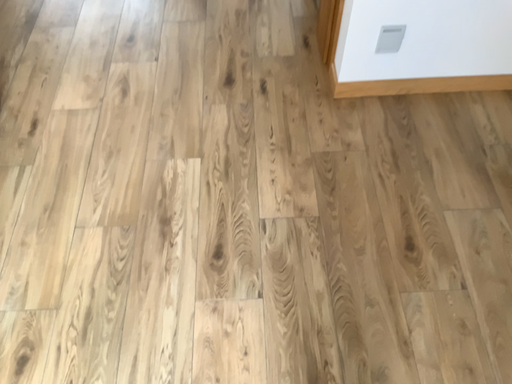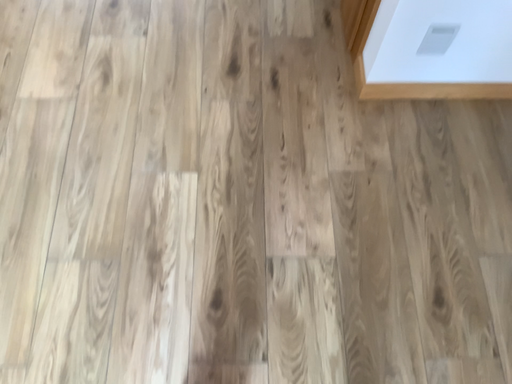
Question: How did the camera likely rotate when shooting the video?

Choices:
 (A) rotated upward
 (B) rotated downward

Answer: (B)